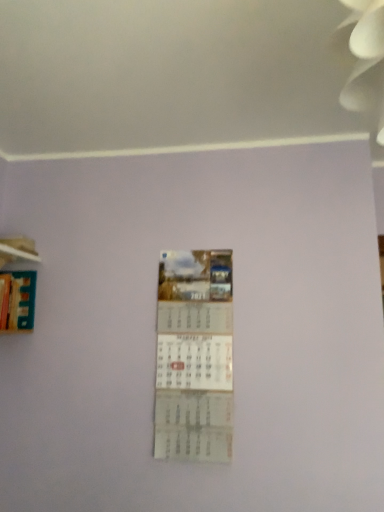
Measure the distance between wooden at left and camera.

wooden at left and camera are 5.82 feet apart.

Image resolution: width=384 pixels, height=512 pixels. What do you see at coordinates (17, 301) in the screenshot?
I see `hardcover book at left` at bounding box center [17, 301].

This screenshot has width=384, height=512. I want to click on wooden at left, so click(18, 250).

Is hardcover book at left surrounded by white paper calendar at center?

Definitely not — hardcover book at left is not inside white paper calendar at center.

Between white paper calendar at center and hardcover book at left, which one has smaller width?

white paper calendar at center is thinner.

Is white paper calendar at center oriented towards hardcover book at left?

No, white paper calendar at center does not turn towards hardcover book at left.

Does white paper calendar at center have a larger size compared to hardcover book at left?

No, white paper calendar at center is not bigger than hardcover book at left.

Is white paper calendar at center in front of or behind wooden at left in the image?

white paper calendar at center is in front of wooden at left.

Which object is positioned more to the left, white paper calendar at center or wooden at left?

From the viewer's perspective, wooden at left appears more on the left side.

Is white paper calendar at center bigger than wooden at left?

Yes, white paper calendar at center is bigger than wooden at left.

Which of these two, white paper calendar at center or wooden at left, is wider?

With larger width is wooden at left.

Visually, is hardcover book at left positioned to the left or to the right of wooden at left?

In the image, hardcover book at left appears on the left side of wooden at left.

Is wooden at left inside hardcover book at left?

No, wooden at left is not surrounded by hardcover book at left.

Is hardcover book at left oriented away from wooden at left?

No, wooden at left is not at the back of hardcover book at left.

Looking at this image, is hardcover book at left shorter than wooden at left?

In fact, hardcover book at left may be taller than wooden at left.

Consider the image. Is hardcover book at left surrounding white paper calendar at center?

No.

Considering the relative positions of hardcover book at left and white paper calendar at center in the image provided, is hardcover book at left to the left of white paper calendar at center from the viewer's perspective?

Yes, hardcover book at left is to the left of white paper calendar at center.

Between hardcover book at left and white paper calendar at center, which one has smaller width?

white paper calendar at center is thinner.

Which is behind, point (3, 293) or point (208, 316)?

Positioned behind is point (3, 293).

Is wooden at left not near white paper calendar at center?

No, wooden at left is not far away from white paper calendar at center.

In the image, is wooden at left positioned in front of or behind white paper calendar at center?

wooden at left is positioned farther from the viewer than white paper calendar at center.

Considering the sizes of objects wooden at left and white paper calendar at center in the image provided, who is shorter, wooden at left or white paper calendar at center?

Standing shorter between the two is wooden at left.

Is wooden at left at the left side of white paper calendar at center?

Correct, you'll find wooden at left to the left of white paper calendar at center.

Which object is further away from the camera taking this photo, wooden at left or hardcover book at left?

wooden at left.

Which of these two, wooden at left or hardcover book at left, is wider?

With larger width is hardcover book at left.

Does wooden at left have a lesser height compared to hardcover book at left?

Indeed, wooden at left has a lesser height compared to hardcover book at left.

How many degrees apart are the facing directions of wooden at left and hardcover book at left?

The angle between the facing direction of wooden at left and the facing direction of hardcover book at left is 0.00266 degrees.

Locate an element on the screen. poster below the hardcover book at left (from the image's perspective) is located at coordinates (194, 357).

At what (x,y) coordinates should I click in order to perform the action: click on poster lying in front of the wooden at left. Please return your answer as a coordinate pair (x, y). The image size is (384, 512). Looking at the image, I should click on (194, 357).

Considering their positions, is wooden at left positioned closer to white paper calendar at center than hardcover book at left?

hardcover book at left.

Based on their spatial positions, is hardcover book at left or white paper calendar at center further from wooden at left?

Among the two, white paper calendar at center is located further to wooden at left.

Looking at the image, which one is located closer to white paper calendar at center, hardcover book at left or wooden at left?

hardcover book at left is positioned closer to the anchor white paper calendar at center.

Looking at the image, which one is located closer to wooden at left, white paper calendar at center or hardcover book at left?

The object closer to wooden at left is hardcover book at left.

Looking at the image, which one is located further to hardcover book at left, wooden at left or white paper calendar at center?

white paper calendar at center is positioned further to the anchor hardcover book at left.

Based on their spatial positions, is white paper calendar at center or wooden at left further from hardcover book at left?

white paper calendar at center is further to hardcover book at left.

The image size is (384, 512). I want to click on shelf situated between hardcover book at left and white paper calendar at center from left to right, so click(x=18, y=250).